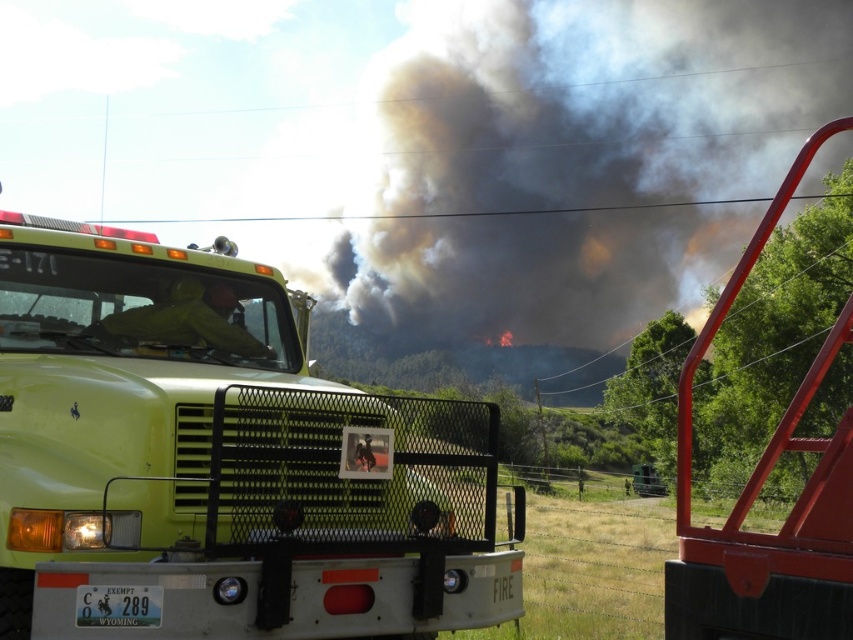
Question: Which object is farther from the camera taking this photo?

Choices:
 (A) green matte fire truck at center
 (B) dark gray smoke at upper center

Answer: (B)

Question: Is green matte fire truck at center to the right of dark gray smoke at upper center from the viewer's perspective?

Choices:
 (A) no
 (B) yes

Answer: (A)

Question: Does green matte fire truck at center appear on the left side of dark gray smoke at upper center?

Choices:
 (A) no
 (B) yes

Answer: (B)

Question: Is green matte fire truck at center to the right of dark gray smoke at upper center from the viewer's perspective?

Choices:
 (A) yes
 (B) no

Answer: (B)